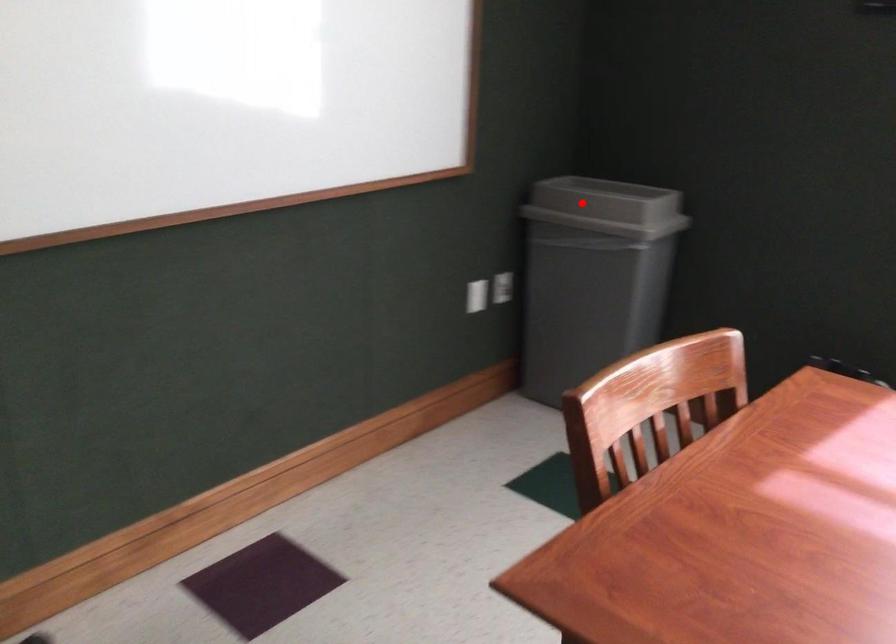
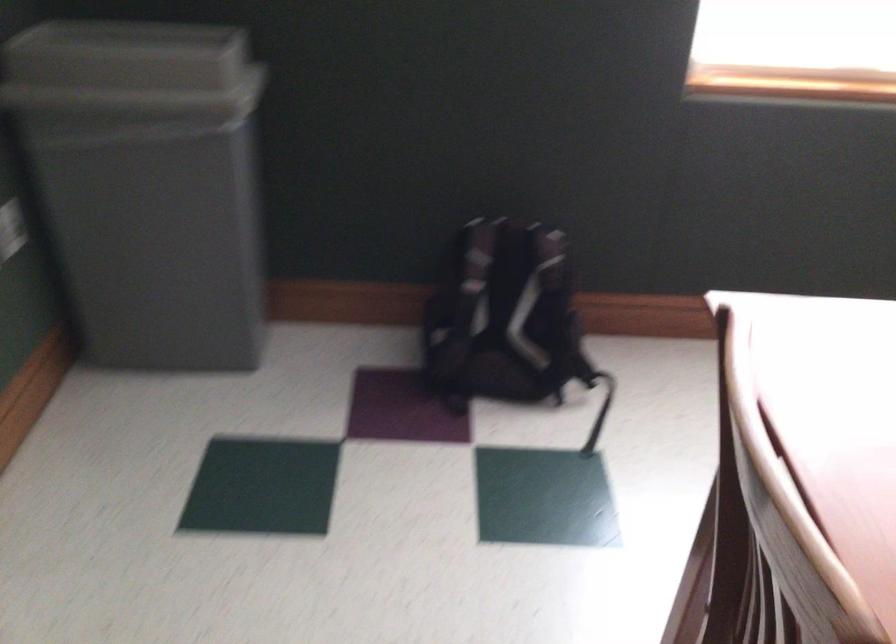
The point at the highlighted location is marked in the first image. Where is the corresponding point in the second image?

(131, 71)